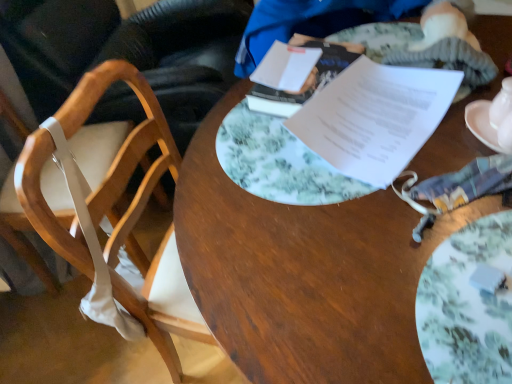
You are a GUI agent. You are given a task and a screenshot of the screen. Output one action in this format:
    pyautogui.click(x=<x>, y=<y>)
    Task: Click on the blank space above white paper at upper center, which ranks as the 2th journal in front-to-back order (from a real-world perspective)
    
    Given the screenshot: What is the action you would take?
    pyautogui.click(x=297, y=63)